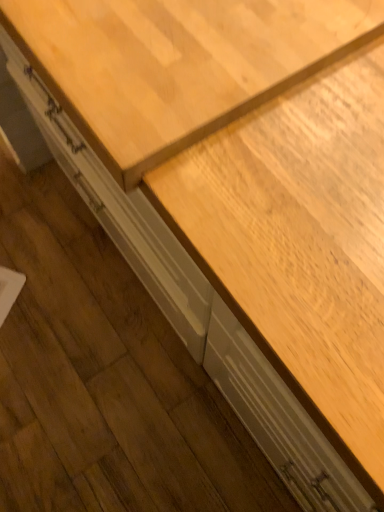
You are a GUI agent. You are given a task and a screenshot of the screen. Output one action in this format:
    pyautogui.click(x=<x>, y=<y>)
    Task: Click on the vacant region above natural wood vanity at upper center (from a real-world perspective)
    The height and width of the screenshot is (512, 384).
    Given the screenshot: What is the action you would take?
    (x=176, y=38)